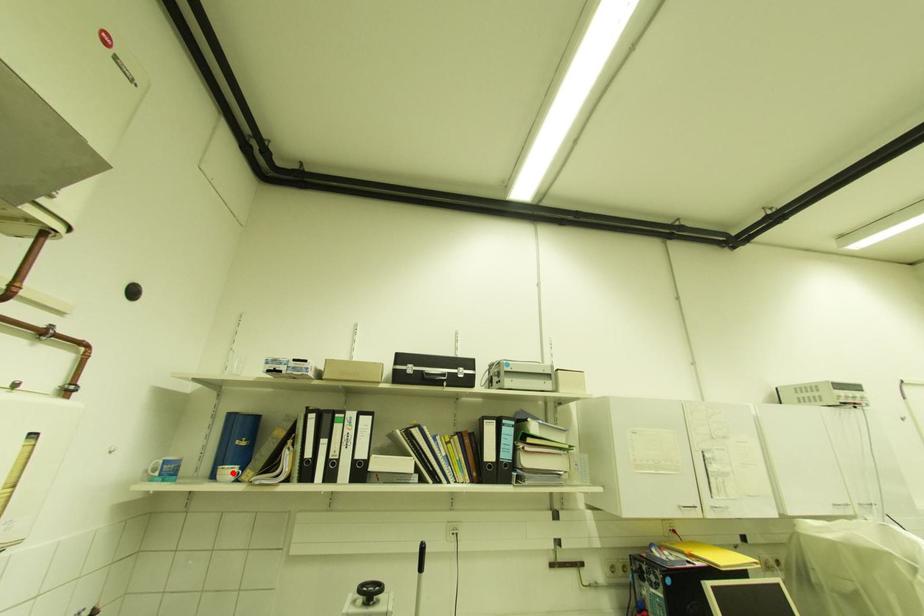
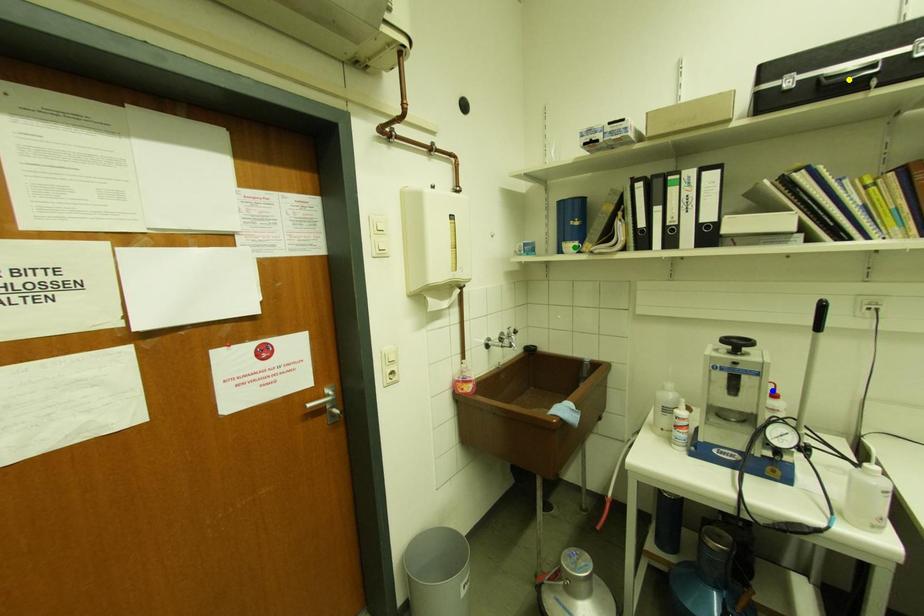
Question: I am providing you with two images of the same scene from different viewpoints. A red point is marked on the first image. You are given multiple points on the second image. Which spot in image 2 lines up with the point in image 1?

Choices:
 (A) blue point
 (B) yellow point
 (C) green point

Answer: (C)